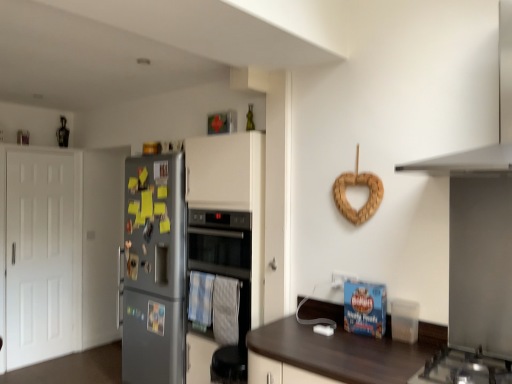
Question: Is white matte door at left closer to the viewer compared to black glass oven at center?

Choices:
 (A) no
 (B) yes

Answer: (A)

Question: Is white matte door at left smaller than black glass oven at center?

Choices:
 (A) yes
 (B) no

Answer: (B)

Question: Can you confirm if white matte door at left is shorter than black glass oven at center?

Choices:
 (A) yes
 (B) no

Answer: (B)

Question: From the image's perspective, is white matte door at left over black glass oven at center?

Choices:
 (A) no
 (B) yes

Answer: (A)

Question: Is white matte door at left at the left side of black glass oven at center?

Choices:
 (A) no
 (B) yes

Answer: (B)

Question: Looking at the image, does stainless steel gas stove at lower right seem bigger or smaller compared to black glass oven at center?

Choices:
 (A) small
 (B) big

Answer: (A)

Question: From their relative heights in the image, would you say stainless steel gas stove at lower right is taller or shorter than black glass oven at center?

Choices:
 (A) short
 (B) tall

Answer: (A)

Question: From a real-world perspective, is stainless steel gas stove at lower right positioned above or below black glass oven at center?

Choices:
 (A) below
 (B) above

Answer: (A)

Question: Is stainless steel gas stove at lower right wider or thinner than black glass oven at center?

Choices:
 (A) wide
 (B) thin

Answer: (A)

Question: Is point (152, 210) positioned closer to the camera than point (212, 213)?

Choices:
 (A) farther
 (B) closer

Answer: (A)

Question: Is satin silver fridge at left spatially inside black glass oven at center, or outside of it?

Choices:
 (A) outside
 (B) inside

Answer: (A)

Question: From their relative heights in the image, would you say satin silver fridge at left is taller or shorter than black glass oven at center?

Choices:
 (A) short
 (B) tall

Answer: (B)

Question: Considering their positions, is satin silver fridge at left located in front of or behind black glass oven at center?

Choices:
 (A) front
 (B) behind

Answer: (B)

Question: Considering the positions of point (454, 352) and point (507, 139), is point (454, 352) closer or farther from the camera than point (507, 139)?

Choices:
 (A) farther
 (B) closer

Answer: (A)

Question: Considering the positions of stainless steel gas stove at lower right and white matte exhaust hood at upper right in the image, is stainless steel gas stove at lower right bigger or smaller than white matte exhaust hood at upper right?

Choices:
 (A) small
 (B) big

Answer: (A)